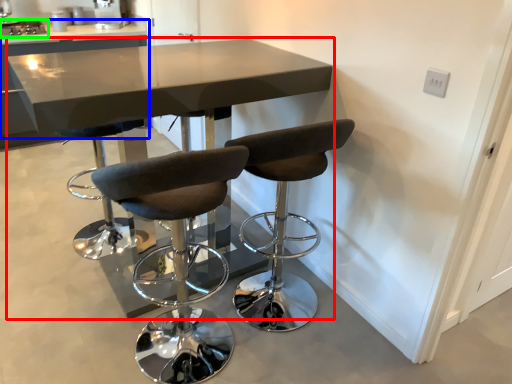
Question: Considering the real-world distances, which object is farthest from table (highlighted by a red box)? table (highlighted by a blue box) or appliance (highlighted by a green box)?

Choices:
 (A) table
 (B) appliance

Answer: (B)